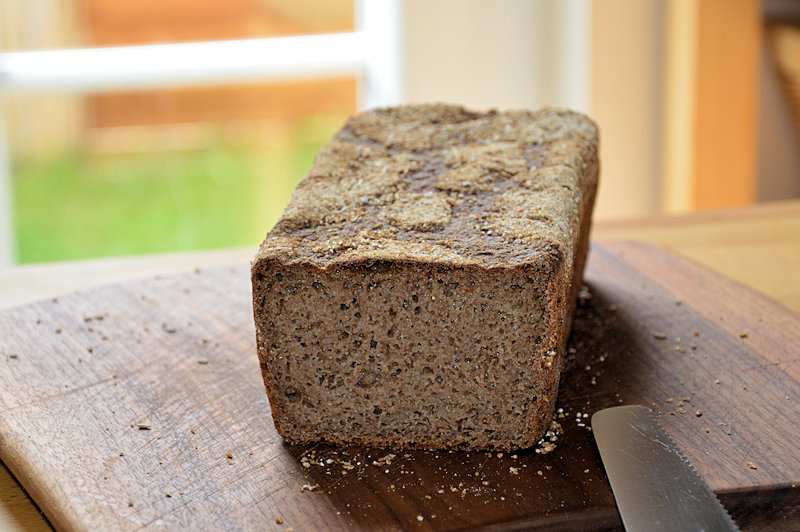
You are a GUI agent. You are given a task and a screenshot of the screen. Output one action in this format:
    pyautogui.click(x=<x>, y=<y>)
    Task: Click on the cutting board
    This screenshot has height=532, width=800.
    Given the screenshot: What is the action you would take?
    pyautogui.click(x=141, y=440)